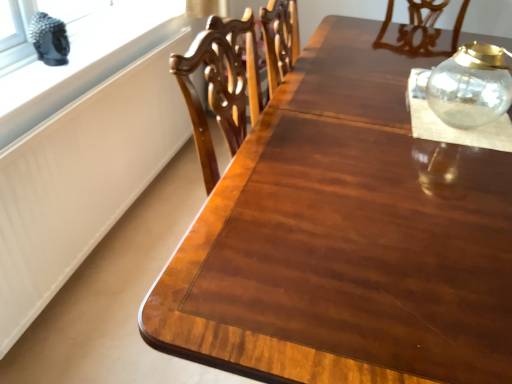
The height and width of the screenshot is (384, 512). In order to click on transparent glass jar at upper right in this screenshot , I will do `click(362, 69)`.

Image resolution: width=512 pixels, height=384 pixels. What do you see at coordinates (362, 69) in the screenshot?
I see `transparent glass jar at upper right` at bounding box center [362, 69].

Where is `white matte window sill at upper left`? white matte window sill at upper left is located at coordinates (86, 47).

Considering the sizes of transparent glass jar at upper right and transparent glass jar at upper right in the image, is transparent glass jar at upper right wider or thinner than transparent glass jar at upper right?

In the image, transparent glass jar at upper right appears to be wider than transparent glass jar at upper right.

Between transparent glass jar at upper right and transparent glass jar at upper right, which one appears on the left side from the viewer's perspective?

transparent glass jar at upper right is more to the left.

From a real-world perspective, who is located higher, transparent glass jar at upper right or transparent glass jar at upper right?

transparent glass jar at upper right is physically above.

Do you think transparent glass jar at upper right is within transparent glass jar at upper right, or outside of it?

transparent glass jar at upper right is outside transparent glass jar at upper right.

Considering the points (402, 67) and (90, 19), which point is behind, point (402, 67) or point (90, 19)?

The point (90, 19) is farther.

From the image's perspective, who appears lower, transparent glass jar at upper right or white matte window sill at upper left?

white matte window sill at upper left, from the image's perspective.

Is white matte window sill at upper left inside transparent glass jar at upper right?

A: No, white matte window sill at upper left is not inside transparent glass jar at upper right.

Is point (506, 66) positioned before point (85, 39)?

Yes, it is.

From the image's perspective, is transparent glass jar at upper right beneath white matte window sill at upper left?

Yes, from the image's perspective, transparent glass jar at upper right is beneath white matte window sill at upper left.

Can you see transparent glass jar at upper right touching white matte window sill at upper left?

No.

Could you tell me if white matte window sill at upper left is facing transparent glass jar at upper right?

No, white matte window sill at upper left is not turned towards transparent glass jar at upper right.

From the image's perspective, is white matte window sill at upper left located above or below transparent glass jar at upper right?

From the image's perspective, white matte window sill at upper left appears below transparent glass jar at upper right.

Considering the sizes of objects white matte window sill at upper left and transparent glass jar at upper right in the image provided, who is smaller, white matte window sill at upper left or transparent glass jar at upper right?

white matte window sill at upper left.

Which is nearer, (148, 27) or (354, 79)?

The point (354, 79) is more forward.

Which is behind, white matte window sill at upper left or transparent glass jar at upper right?

white matte window sill at upper left is further away from the camera.

Can we say white matte window sill at upper left lies outside transparent glass jar at upper right?

Absolutely, white matte window sill at upper left is external to transparent glass jar at upper right.

How different are the orientations of white matte window sill at upper left and transparent glass jar at upper right in degrees?

They differ by 3.72 degrees in their facing directions.

Which object is positioned more to the left, white matte window sill at upper left or transparent glass jar at upper right?

Positioned to the left is white matte window sill at upper left.

From the image's perspective, does transparent glass jar at upper right appear lower than transparent glass jar at upper right?

Yes.

Consider the image. Is transparent glass jar at upper right directly adjacent to transparent glass jar at upper right?

They are not placed beside each other.

Which is in front, transparent glass jar at upper right or transparent glass jar at upper right?

Positioned in front is transparent glass jar at upper right.

Is transparent glass jar at upper right surrounded by transparent glass jar at upper right?

No, transparent glass jar at upper right does not contain transparent glass jar at upper right.

At what (x,y) coordinates should I click in order to perform the action: click on round table behind the transparent glass jar at upper right. Please return your answer as a coordinate pair (x, y). Looking at the image, I should click on (362, 69).

This screenshot has width=512, height=384. Find the location of `window above the transparent glass jar at upper right (from a real-world perspective)`. window above the transparent glass jar at upper right (from a real-world perspective) is located at coordinates (86, 47).

Looking at the image, which one is located further to transparent glass jar at upper right, white matte window sill at upper left or transparent glass jar at upper right?

white matte window sill at upper left lies further to transparent glass jar at upper right than the other object.

Which object lies nearer to the anchor point white matte window sill at upper left, transparent glass jar at upper right or transparent glass jar at upper right?

transparent glass jar at upper right is positioned closer to the anchor white matte window sill at upper left.

Looking at the image, which one is located further to transparent glass jar at upper right, white matte window sill at upper left or transparent glass jar at upper right?

white matte window sill at upper left lies further to transparent glass jar at upper right than the other object.

From the image, which object appears to be farther from transparent glass jar at upper right, transparent glass jar at upper right or white matte window sill at upper left?

white matte window sill at upper left.

Looking at the image, which one is located closer to transparent glass jar at upper right, transparent glass jar at upper right or white matte window sill at upper left?

Based on the image, transparent glass jar at upper right appears to be nearer to transparent glass jar at upper right.

Looking at the image, which one is located further to white matte window sill at upper left, transparent glass jar at upper right or transparent glass jar at upper right?

Based on the image, transparent glass jar at upper right appears to be further to white matte window sill at upper left.

Identify the location of glass vase situated between white matte window sill at upper left and transparent glass jar at upper right from left to right. This screenshot has width=512, height=384. (471, 86).